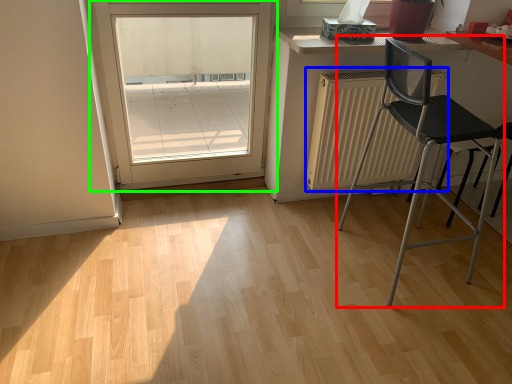
Question: Based on their relative distances, which object is farther from chair (highlighted by a red box)? Choose from radiator (highlighted by a blue box) and door (highlighted by a green box).

Choices:
 (A) radiator
 (B) door

Answer: (B)